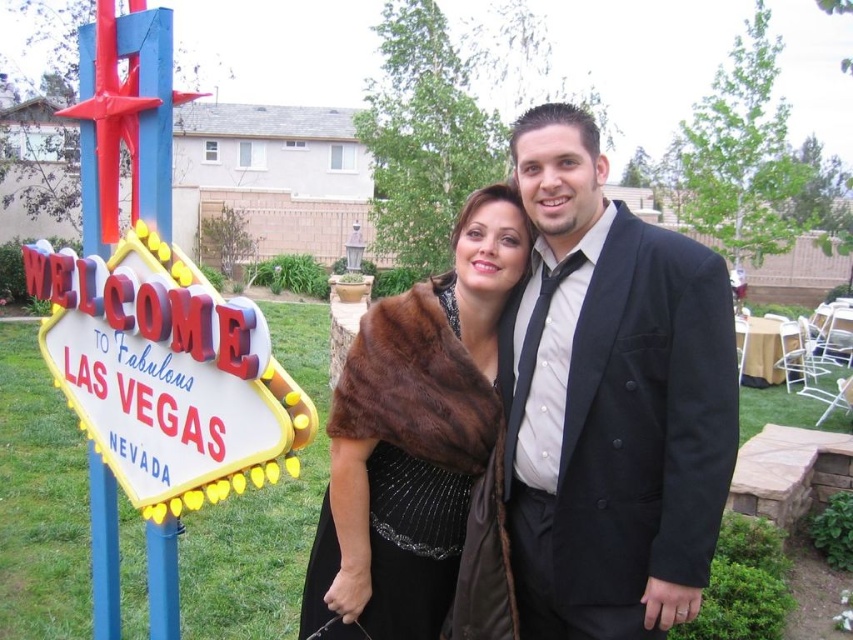
Is black satin suit at center to the right of brown fur shawl at center from the viewer's perspective?

Yes, black satin suit at center is to the right of brown fur shawl at center.

Who is higher up, black satin suit at center or brown fur shawl at center?

black satin suit at center

Which is in front, point (651, 307) or point (402, 358)?

Point (651, 307)

At what (x,y) coordinates should I click in order to perform the action: click on black satin suit at center. Please return your answer as a coordinate pair (x, y). This screenshot has height=640, width=853. Looking at the image, I should click on (610, 401).

Is black satin suit at center smaller than neon sign at left?

Yes, black satin suit at center is smaller than neon sign at left.

Who is lower down, black satin suit at center or neon sign at left?

neon sign at left is below.

Who is more forward, (x=668, y=369) or (x=120, y=374)?

Positioned in front is point (x=668, y=369).

The height and width of the screenshot is (640, 853). Find the location of `black satin suit at center`. black satin suit at center is located at coordinates (610, 401).

Can you confirm if brown fur shawl at center is wider than neon sign at left?

No, brown fur shawl at center is not wider than neon sign at left.

Consider the image. Who is lower down, brown fur shawl at center or neon sign at left?

Positioned lower is brown fur shawl at center.

Between point (318, 564) and point (103, 301), which one is positioned behind?

Positioned behind is point (318, 564).

I want to click on brown fur shawl at center, so click(413, 436).